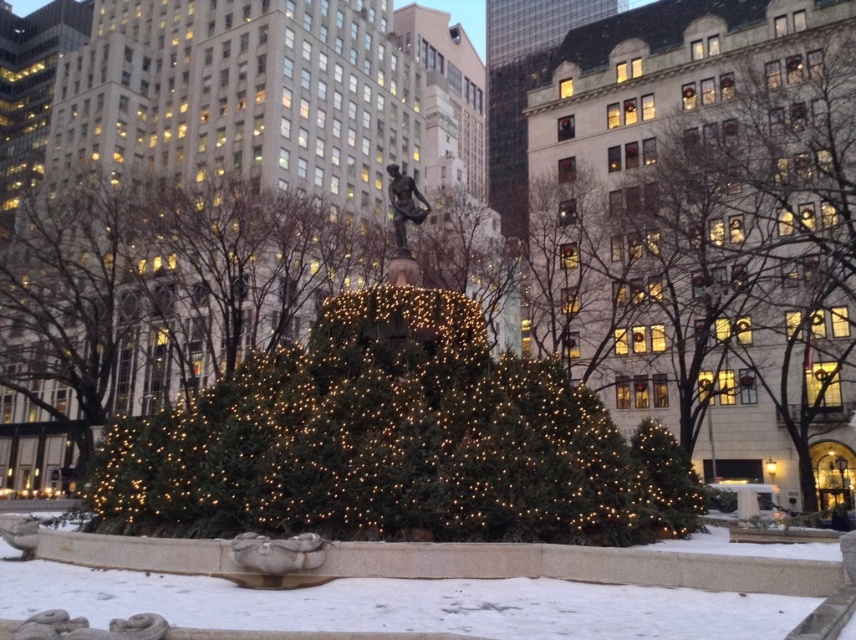
You are standing in the middle of the festive urban scene and want to place a small gift box under the green matte christmas tree at center. However, there is white snow at center. Where should you place the gift box?

The green matte christmas tree at center is located above white snow at center, so you should place the gift box on the white snow at center under the tree.

You are a city planner reviewing the holiday decorations. You need to ensure that the green matte christmas tree at center and the white snow at center are both visible in promotional photos. Based on their sizes, which one might require more strategic lighting to highlight its details?

The white snow at center might require more strategic lighting because the green matte christmas tree at center is bigger and could overshadow it in the photo.

You are standing in the festive urban scene and want to take a photo of both the point at coordinates point (346, 525) and the point at coordinates point (734, 552). Which point should you focus on first to ensure both are in focus?

You should focus on point (346, 525) first because it is closer to the camera than point (734, 552). By focusing on the closer point, the depth of field may include the farther point in acceptable focus.